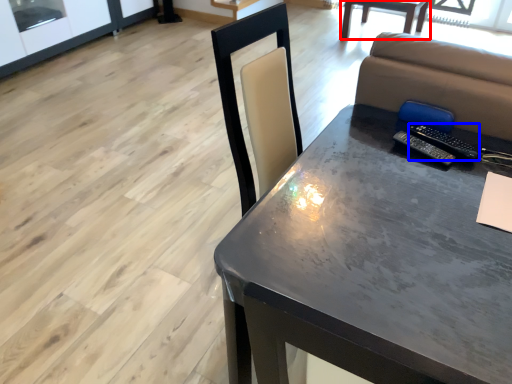
Question: Which point is closer to the camera, table (highlighted by a red box) or remote (highlighted by a blue box)?

Choices:
 (A) table
 (B) remote

Answer: (B)